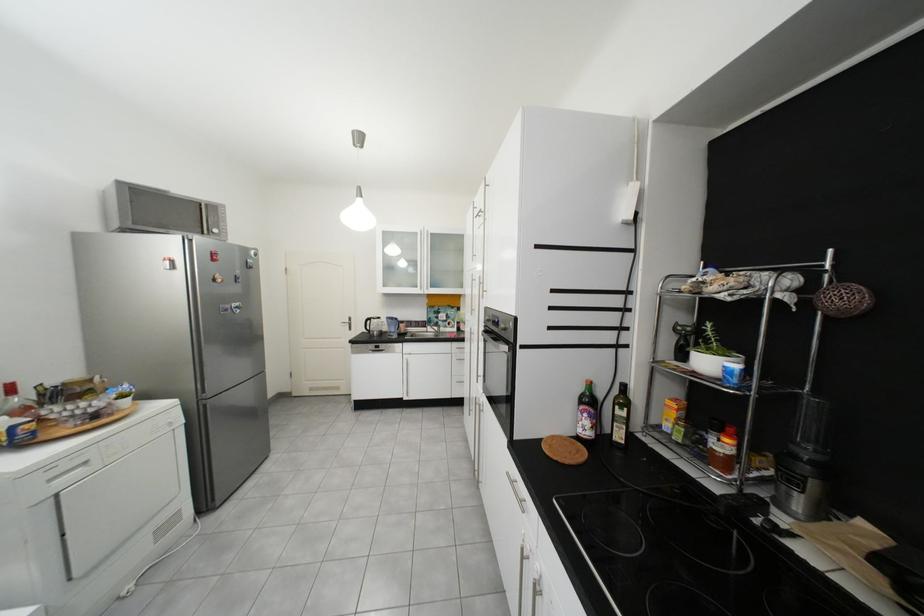
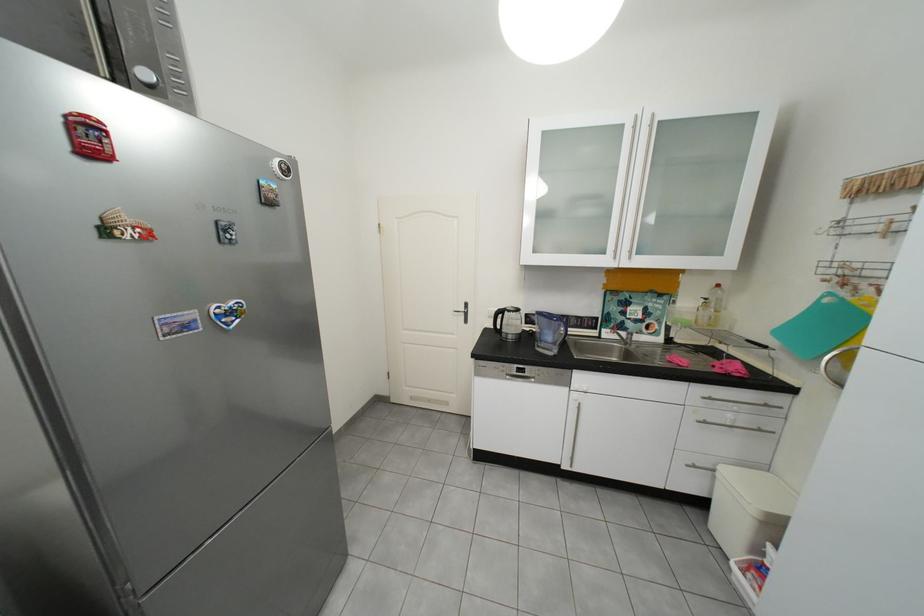
What movement of the cameraman would produce the second image?

The movement direction of the cameraman is left, forward.